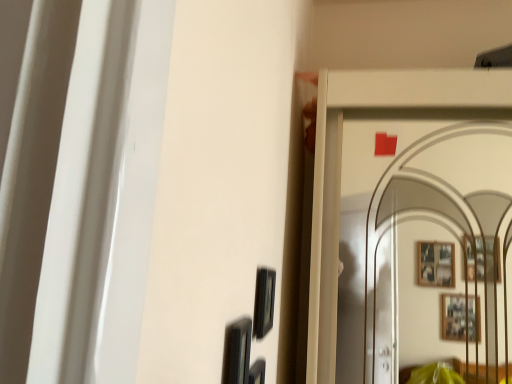
Question: Does black glossy picture frame at lower center, acting as the 1th picture frame starting from the front, have a greater width compared to matte black picture frame at center, positioned as the 1th picture frame in back-to-front order?

Choices:
 (A) yes
 (B) no

Answer: (A)

Question: Can you confirm if black glossy picture frame at lower center, acting as the 1th picture frame starting from the front, is bigger than matte black picture frame at center, the second picture frame in the front-to-back sequence?

Choices:
 (A) no
 (B) yes

Answer: (B)

Question: From the image's perspective, is black glossy picture frame at lower center, acting as the 1th picture frame starting from the front, above matte black picture frame at center, positioned as the 1th picture frame in back-to-front order?

Choices:
 (A) yes
 (B) no

Answer: (B)

Question: Is black glossy picture frame at lower center, acting as the 1th picture frame starting from the front, thinner than matte black picture frame at center, the second picture frame in the front-to-back sequence?

Choices:
 (A) no
 (B) yes

Answer: (A)

Question: Is black glossy picture frame at lower center, the second picture frame positioned from the back, aimed at matte black picture frame at center, the second picture frame in the front-to-back sequence?

Choices:
 (A) yes
 (B) no

Answer: (B)

Question: Can you see black glossy picture frame at lower center, acting as the 1th picture frame starting from the front, touching matte black picture frame at center, positioned as the 1th picture frame in back-to-front order?

Choices:
 (A) yes
 (B) no

Answer: (B)

Question: Considering the relative sizes of matte black picture frame at center, the second picture frame in the front-to-back sequence, and black glossy picture frame at lower center, the second picture frame positioned from the back, in the image provided, is matte black picture frame at center, the second picture frame in the front-to-back sequence, wider than black glossy picture frame at lower center, the second picture frame positioned from the back,?

Choices:
 (A) no
 (B) yes

Answer: (A)

Question: Considering the relative sizes of matte black picture frame at center, the second picture frame in the front-to-back sequence, and black glossy picture frame at lower center, acting as the 1th picture frame starting from the front, in the image provided, is matte black picture frame at center, the second picture frame in the front-to-back sequence, smaller than black glossy picture frame at lower center, acting as the 1th picture frame starting from the front,?

Choices:
 (A) yes
 (B) no

Answer: (A)

Question: Is matte black picture frame at center, positioned as the 1th picture frame in back-to-front order, bigger than black glossy picture frame at lower center, acting as the 1th picture frame starting from the front?

Choices:
 (A) no
 (B) yes

Answer: (A)

Question: Is matte black picture frame at center, positioned as the 1th picture frame in back-to-front order, far away from black glossy picture frame at lower center, the second picture frame positioned from the back?

Choices:
 (A) no
 (B) yes

Answer: (A)

Question: Can you confirm if matte black picture frame at center, positioned as the 1th picture frame in back-to-front order, is positioned to the right of black glossy picture frame at lower center, the second picture frame positioned from the back?

Choices:
 (A) yes
 (B) no

Answer: (A)

Question: Is matte black picture frame at center, the second picture frame in the front-to-back sequence, with black glossy picture frame at lower center, acting as the 1th picture frame starting from the front?

Choices:
 (A) yes
 (B) no

Answer: (B)

Question: Is matte black picture frame at center, the second picture frame in the front-to-back sequence, inside or outside of black glossy picture frame at lower center, the second picture frame positioned from the back?

Choices:
 (A) outside
 (B) inside

Answer: (A)